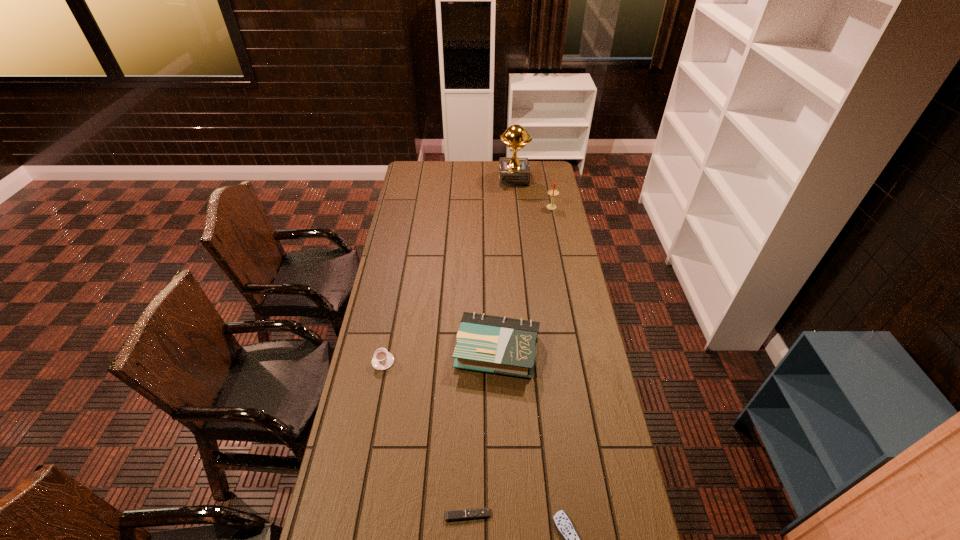
Locate an element on the screen. The width and height of the screenshot is (960, 540). the farthest object is located at coordinates (513, 171).

Identify the location of award. The width and height of the screenshot is (960, 540). (513, 171).

Where is `the second tallest object`? This screenshot has height=540, width=960. the second tallest object is located at coordinates (552, 192).

Identify the location of the second farthest object. The height and width of the screenshot is (540, 960). (x=552, y=192).

Where is `the fourth shortest object`? The height and width of the screenshot is (540, 960). the fourth shortest object is located at coordinates (500, 345).

Find the location of a particular element. This screenshot has height=540, width=960. the leftmost object is located at coordinates (382, 360).

This screenshot has height=540, width=960. Identify the location of teacup. (382, 360).

This screenshot has height=540, width=960. What are the coordinates of `the left remote control` in the screenshot? It's located at (451, 515).

What are the coordinates of `the shortest object` in the screenshot? It's located at (451, 515).

I want to click on vacant region located on the front-facing side of the tallest object, so click(460, 179).